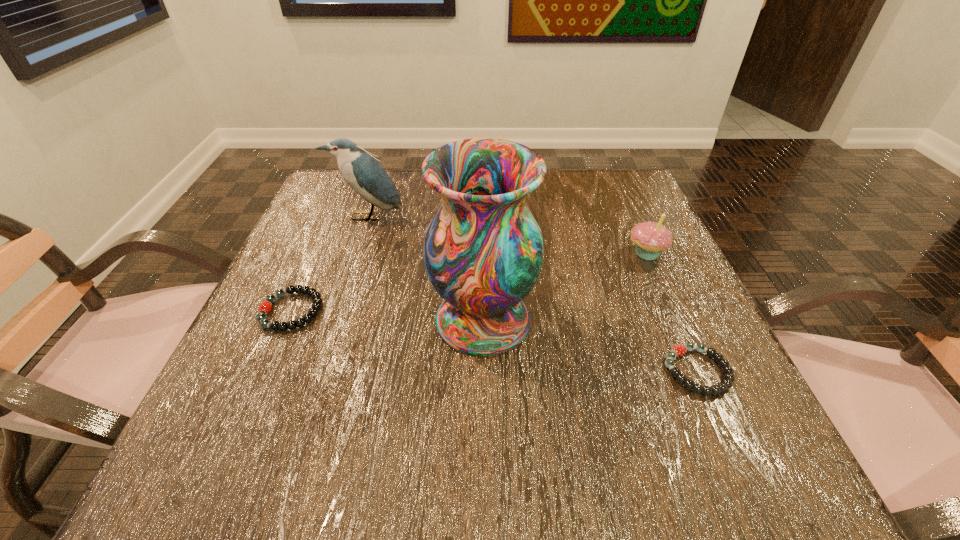
Locate an element on the screen. The height and width of the screenshot is (540, 960). blank space that satisfies the following two spatial constraints: 1. at the tip of the bird's beak; 2. on the right side of the third object from right to left is located at coordinates (332, 320).